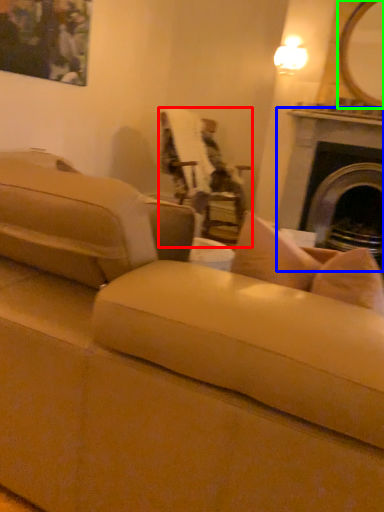
Question: Which object is the farthest from chair (highlighted by a red box)? Choose among these: fireplace (highlighted by a blue box) or mirror (highlighted by a green box).

Choices:
 (A) fireplace
 (B) mirror

Answer: (B)